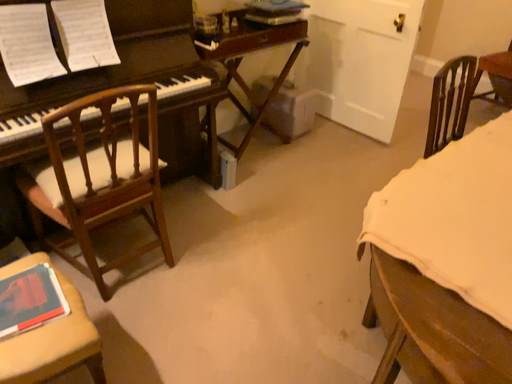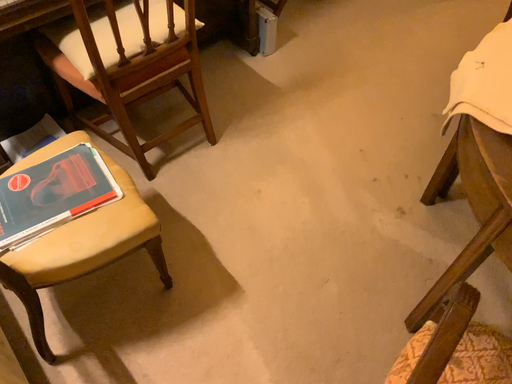
Question: Which way did the camera rotate in the video?

Choices:
 (A) rotated upward
 (B) rotated downward

Answer: (B)